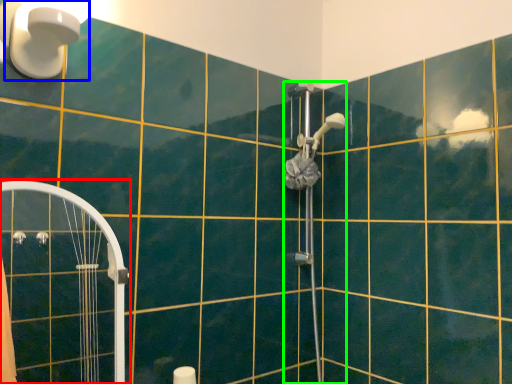
Question: Estimate the real-world distances between objects in this image. Which object is farther from shower door (highlighted by a red box), light fixture (highlighted by a blue box) or shower (highlighted by a green box)?

Choices:
 (A) light fixture
 (B) shower

Answer: (B)